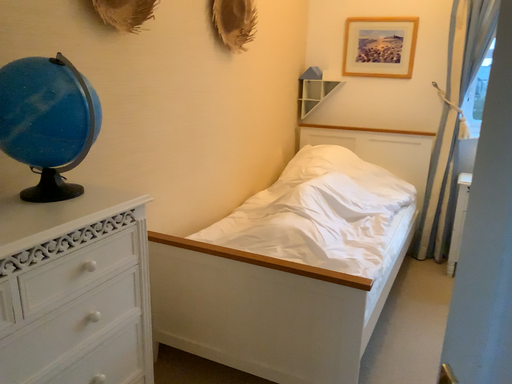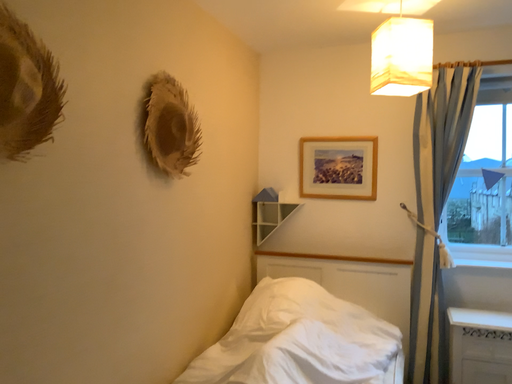
Question: Which way did the camera rotate in the video?

Choices:
 (A) rotated upward
 (B) rotated downward

Answer: (A)